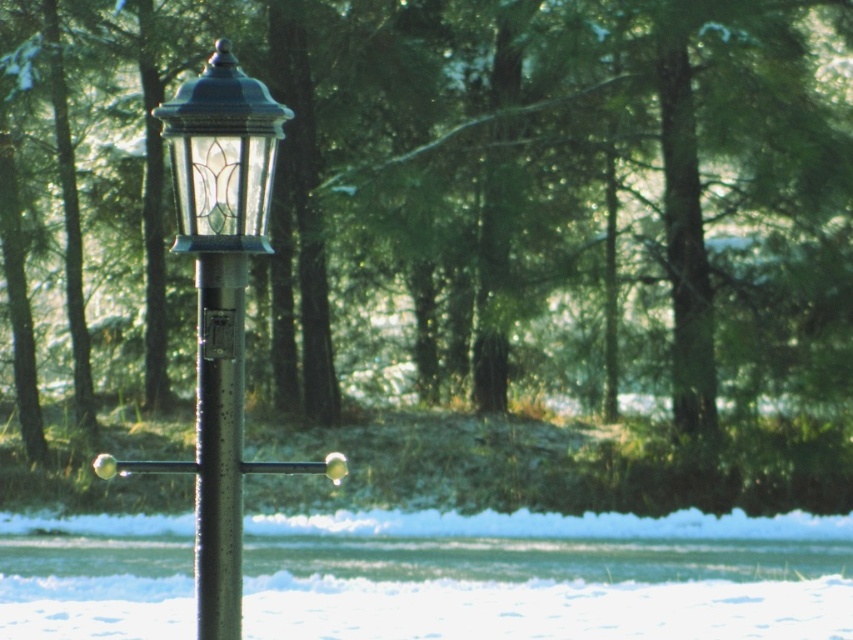
Question: Which object appears farthest from the camera in this image?

Choices:
 (A) matte glass lantern at center
 (B) glossy metal street light at center
 (C) metallic pole at center

Answer: (C)

Question: Which point appears closest to the camera in this image?

Choices:
 (A) (206, 346)
 (B) (192, 115)

Answer: (B)

Question: Can you confirm if glossy metal street light at center is positioned below matte glass lantern at center?

Choices:
 (A) yes
 (B) no

Answer: (A)

Question: Is glossy metal street light at center to the left of metallic pole at center from the viewer's perspective?

Choices:
 (A) yes
 (B) no

Answer: (B)

Question: Does matte glass lantern at center have a lesser width compared to metallic pole at center?

Choices:
 (A) no
 (B) yes

Answer: (A)

Question: Which point is closer to the camera?

Choices:
 (A) (245, 218)
 (B) (219, 401)

Answer: (A)